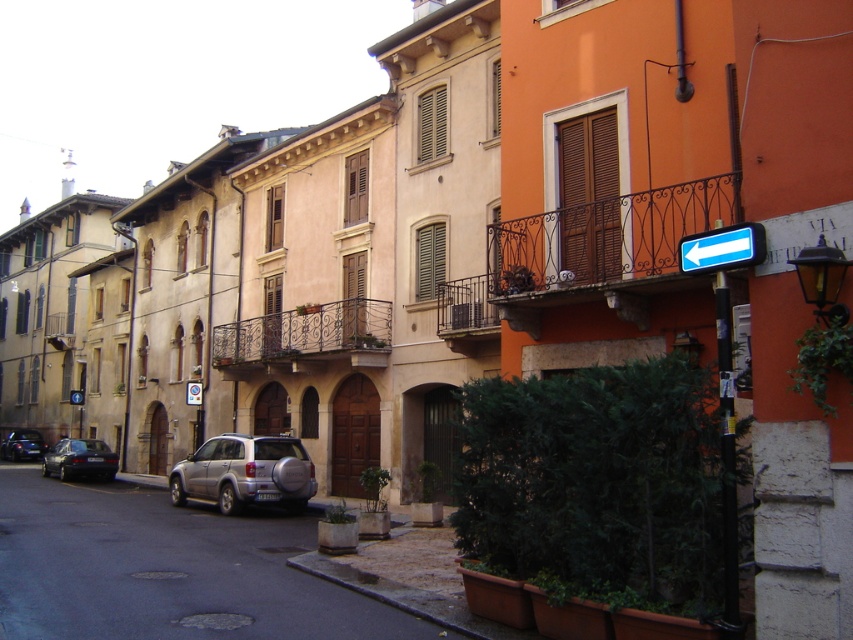
Between metallic silver suv at center and rustic wrought iron balcony at center right, which one is positioned lower?

metallic silver suv at center is below.

Is point (228, 611) positioned behind point (550, 218)?

No, (228, 611) is in front of (550, 218).

This screenshot has height=640, width=853. What are the coordinates of `metallic silver suv at center` in the screenshot? It's located at (166, 570).

Is iron-forged balcony at center further to camera compared to shiny black sedan at lower left?

No, iron-forged balcony at center is closer to the viewer.

Does iron-forged balcony at center appear over shiny black sedan at lower left?

Yes.

Identify the location of iron-forged balcony at center. This screenshot has width=853, height=640. (305, 332).

Is blue plastic sign at right above iron-forged balcony at center?

Yes, blue plastic sign at right is above iron-forged balcony at center.

You are a GUI agent. You are given a task and a screenshot of the screen. Output one action in this format:
    pyautogui.click(x=<x>, y=<y>)
    Task: Click on the blue plastic sign at right
    The width and height of the screenshot is (853, 640).
    Given the screenshot: What is the action you would take?
    pyautogui.click(x=724, y=378)

Locate an element on the screen. blue plastic sign at right is located at coordinates (724, 378).